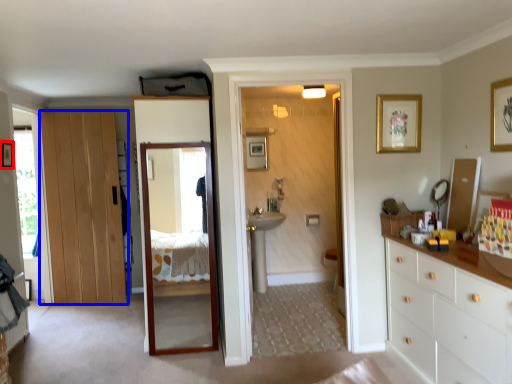
Question: Which of the following is the closest to the observer, picture frame (highlighted by a red box) or door (highlighted by a blue box)?

Choices:
 (A) picture frame
 (B) door

Answer: (A)